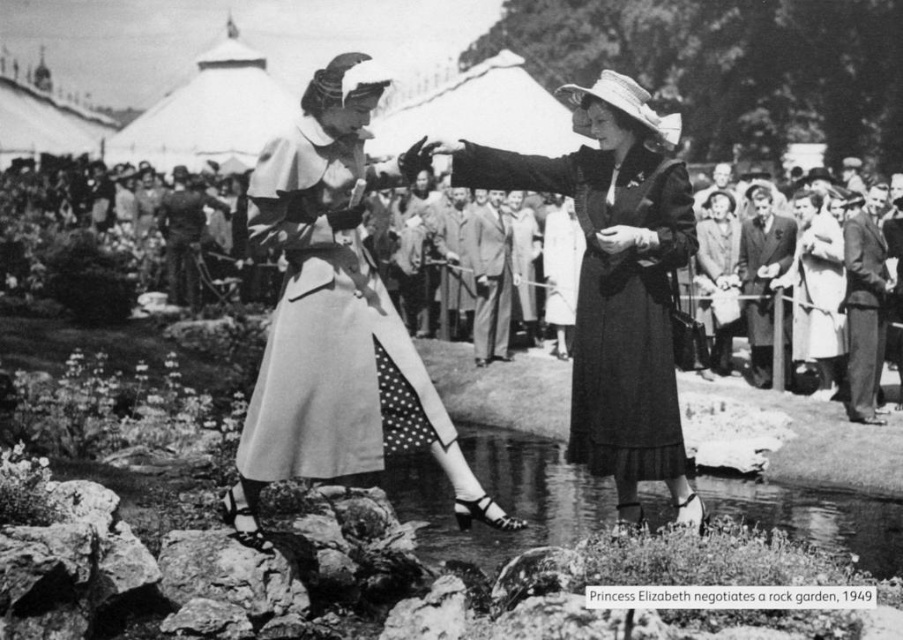
You are a photographer at the 1949 garden show. You see the clear water at pond center and the smooth fabric suits at center. Which object is positioned to the right of the other?

The clear water at pond center is to the right of the smooth fabric suits at center.

You are a photographer standing at the edge of the rock garden. You want to take a photo of the clear water at pond center and the smooth fabric suits at center. How far apart are these two objects from each other?

The clear water at pond center is 57.14 feet away from the smooth fabric suits at center.